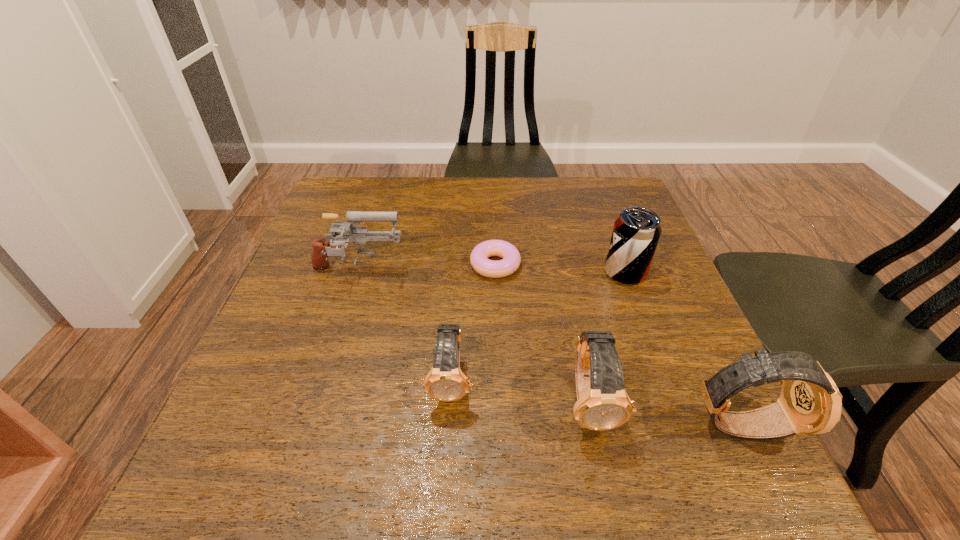
The image size is (960, 540). Find the location of `vacant area situated 0.090m on the back of the soda can`. vacant area situated 0.090m on the back of the soda can is located at coordinates (612, 237).

Where is `object located in the left edge section of the desktop`? The image size is (960, 540). object located in the left edge section of the desktop is located at coordinates (359, 235).

Find the location of a particular element. Image resolution: width=960 pixels, height=540 pixels. watch that is at the right edge is located at coordinates point(810,403).

This screenshot has height=540, width=960. Identify the location of soda can at the right edge. (636, 232).

At what (x,y) coordinates should I click in order to perform the action: click on object present at the near right corner. Please return your answer as a coordinate pair (x, y). Looking at the image, I should click on (810, 403).

Locate an element on the screen. The height and width of the screenshot is (540, 960). free region at the far edge of the desktop is located at coordinates (483, 214).

Find the location of a particular element. blank area at the near edge is located at coordinates (566, 415).

At what (x,y) coordinates should I click in order to perform the action: click on free space at the left edge of the desktop. Please return your answer as a coordinate pair (x, y). Image resolution: width=960 pixels, height=540 pixels. Looking at the image, I should click on 259,333.

At what (x,y) coordinates should I click in order to perform the action: click on free space at the right edge of the desktop. Please return your answer as a coordinate pair (x, y). This screenshot has width=960, height=540. Looking at the image, I should click on (599, 256).

Where is `free space at the far left corner of the desktop`? The height and width of the screenshot is (540, 960). free space at the far left corner of the desktop is located at coordinates (365, 181).